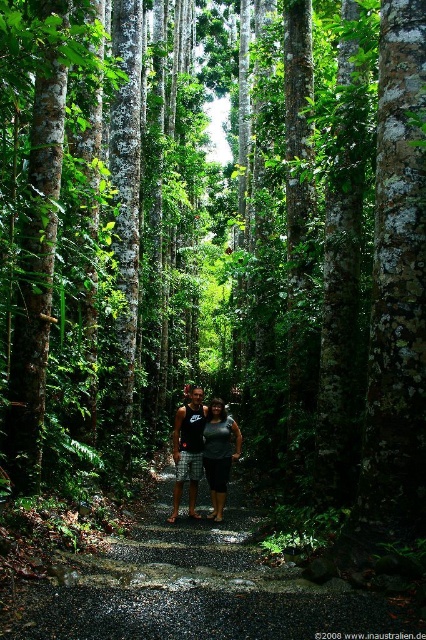
You are a hiker on the forest path and want to take a photo of both the matte black tank top at center and the matte gray shorts at center. Which direction should you face to ensure both are in the frame?

You should face to the right to include both the matte black tank top at center and the matte gray shorts at center in the frame since the matte black tank top at center is to the left of the matte gray shorts at center.